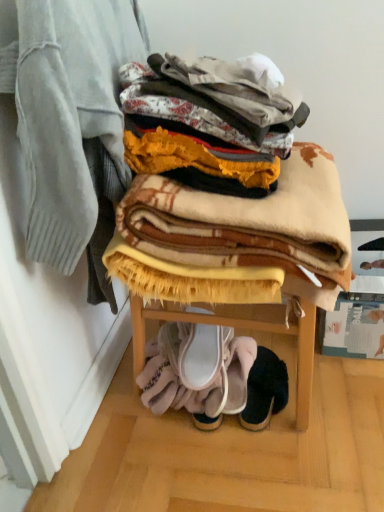
Question: Which is correct: white fabric slipper at lower center, positioned as the third footwear in right-to-left order, is inside black suede slipper at lower center, marked as the 1th footwear in a right-to-left arrangement, or outside of it?

Choices:
 (A) inside
 (B) outside

Answer: (B)

Question: From the image's perspective, is white fabric slipper at lower center, positioned as the third footwear in right-to-left order, located above or below black suede slipper at lower center, the 3th footwear positioned from the left?

Choices:
 (A) above
 (B) below

Answer: (A)

Question: Which object is the farthest from the black suede slipper at lower center, marked as the 1th footwear in a right-to-left arrangement?

Choices:
 (A) white fabric slipper at lower center, acting as the second footwear starting from the left
 (B) white fabric slipper at lower center, positioned as the third footwear in right-to-left order
 (C) plaid wool blanket at upper center, arranged as the first blanket when viewed from the left
 (D) beige woolen blanket at center, the first blanket in the right-to-left sequence

Answer: (C)

Question: Estimate the real-world distances between objects in this image. Which object is farther from the white fabric slipper at lower center, positioned as the third footwear in right-to-left order?

Choices:
 (A) beige woolen blanket at center, the first blanket in the right-to-left sequence
 (B) black suede slipper at lower center, the 3th footwear positioned from the left
 (C) white fabric slipper at lower center, the 2th footwear positioned from the right
 (D) plaid wool blanket at upper center, which is counted as the second blanket, starting from the right

Answer: (D)